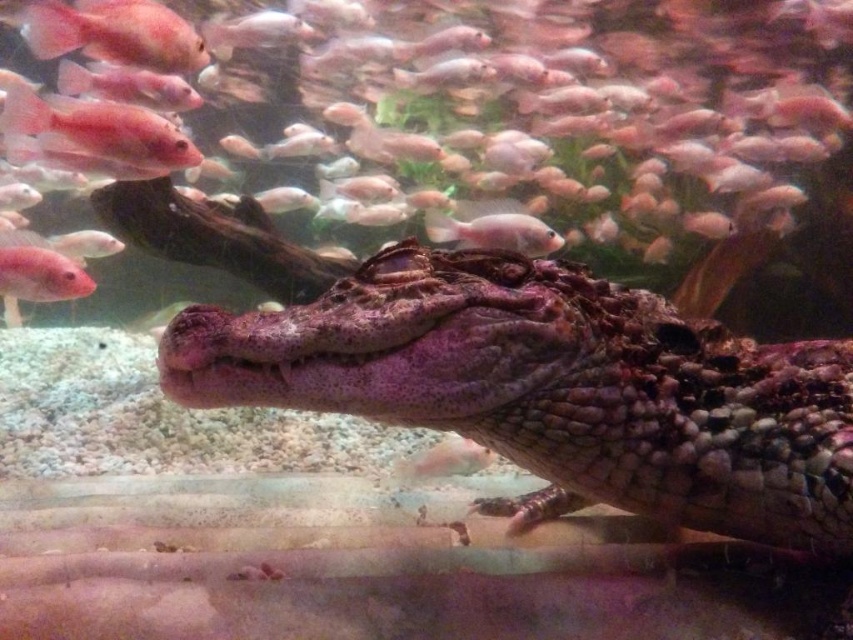
Is pink matte fish at upper center below pink glossy fish at upper left?

Actually, pink matte fish at upper center is above pink glossy fish at upper left.

Can you confirm if pink matte fish at upper center is taller than pink glossy fish at upper left?

Indeed, pink matte fish at upper center has a greater height compared to pink glossy fish at upper left.

Is point (368, 56) positioned before point (96, 147)?

No, (368, 56) is behind (96, 147).

Identify the location of pink matte fish at upper center. (477, 136).

Between pink matte fish at left and pink glossy fish at center, which one appears on the left side from the viewer's perspective?

Positioned to the left is pink matte fish at left.

Does pink matte fish at left appear under pink glossy fish at center?

Yes.

The width and height of the screenshot is (853, 640). In order to click on pink matte fish at left in this screenshot , I will do `click(39, 275)`.

From the picture: Which of these two, pink matte fish at upper center or pink matte fish at left, stands taller?

With more height is pink matte fish at upper center.

Does point (831, 170) come behind point (33, 273)?

Yes, point (831, 170) is behind point (33, 273).

The height and width of the screenshot is (640, 853). I want to click on pink matte fish at upper center, so click(x=477, y=136).